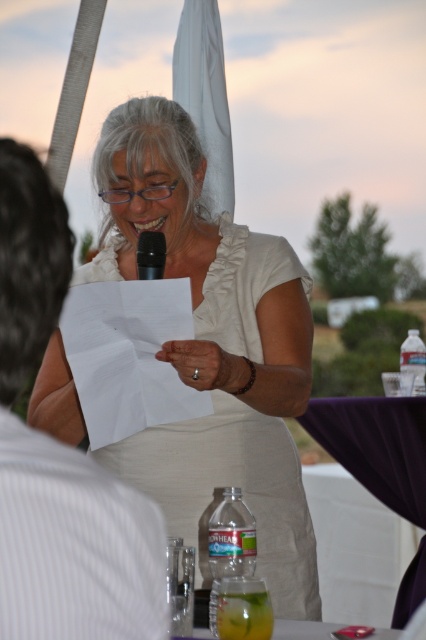
Question: Which object appears farthest from the camera in this image?

Choices:
 (A) white satin dress at center
 (B) black matte microphone at center

Answer: (B)

Question: Is white satin dress at center smaller than black matte microphone at center?

Choices:
 (A) no
 (B) yes

Answer: (A)

Question: Which point is closer to the camera taking this photo?

Choices:
 (A) (36, 188)
 (B) (239, 288)

Answer: (A)

Question: Which of the following is the farthest from the observer?

Choices:
 (A) black matte microphone at center
 (B) white satin dress at center
 (C) white striped shirt at left

Answer: (A)

Question: Does white satin dress at center have a larger size compared to white striped shirt at left?

Choices:
 (A) no
 (B) yes

Answer: (B)

Question: Does white satin dress at center have a smaller size compared to black matte microphone at center?

Choices:
 (A) yes
 (B) no

Answer: (B)